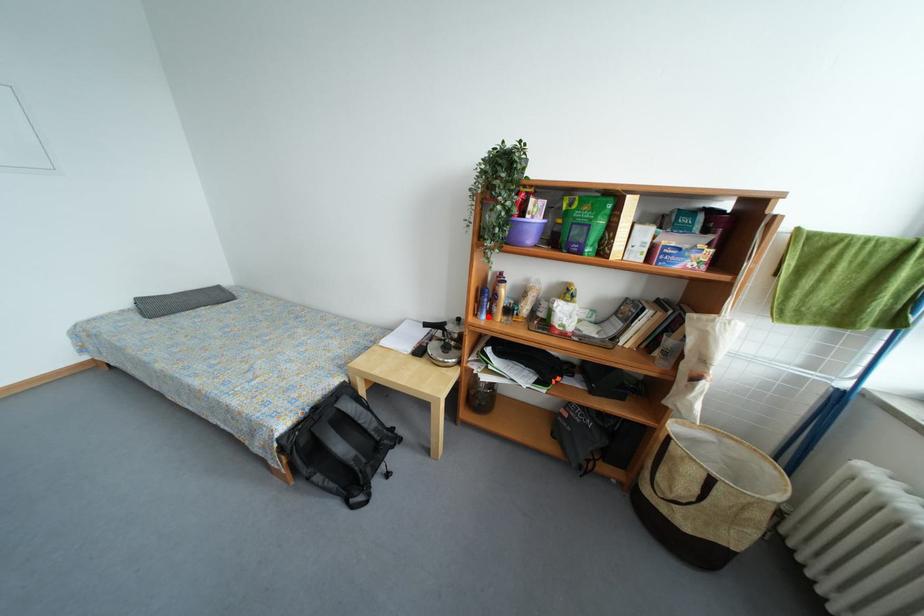
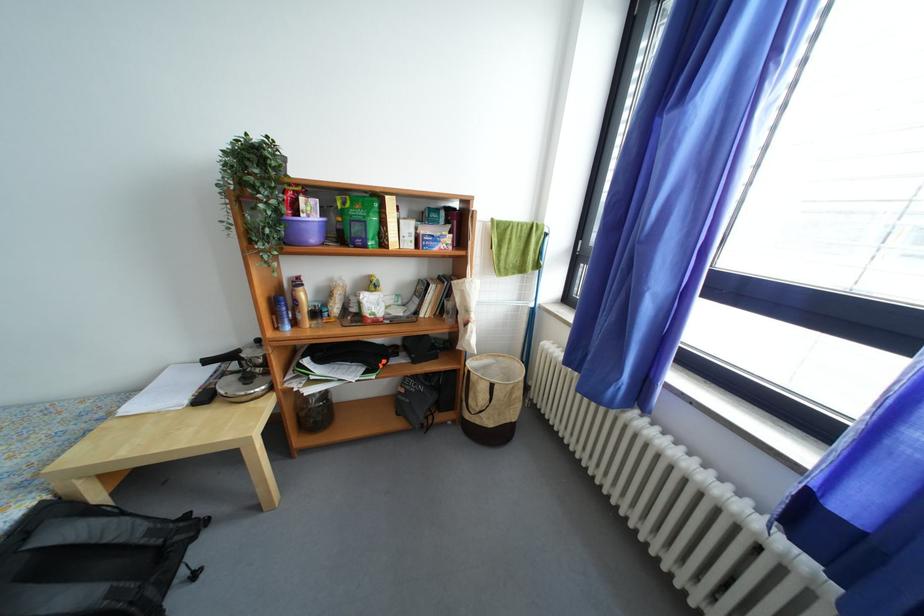
Locate, in the second image, the point that corresponds to the highlighted location in the first image.

(289, 329)